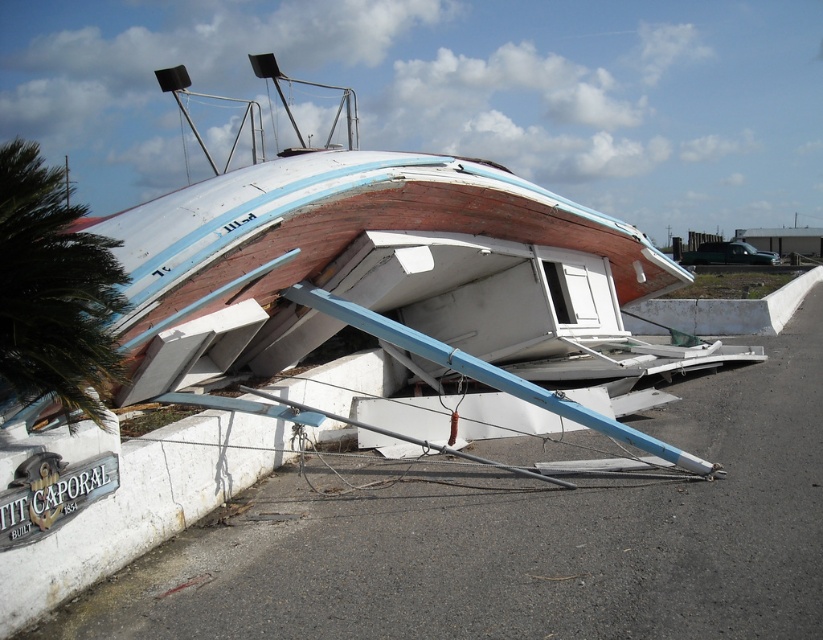
What do you see at coordinates (377, 269) in the screenshot? I see `wooden boat at center` at bounding box center [377, 269].

Which is more to the right, wooden boat at center or green leafy palm tree at left?

Positioned to the right is green leafy palm tree at left.

Is point (171, 376) behind point (103, 356)?

Yes, it is.

The image size is (823, 640). In order to click on wooden boat at center in this screenshot , I will do `click(377, 269)`.